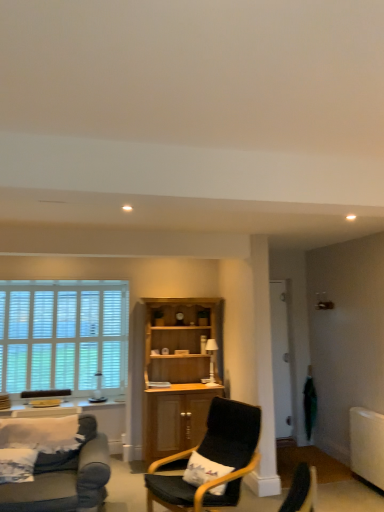
Locate an element on the screen. free point above transparent glass door at center-right (from a real-world perspective) is located at coordinates (273, 280).